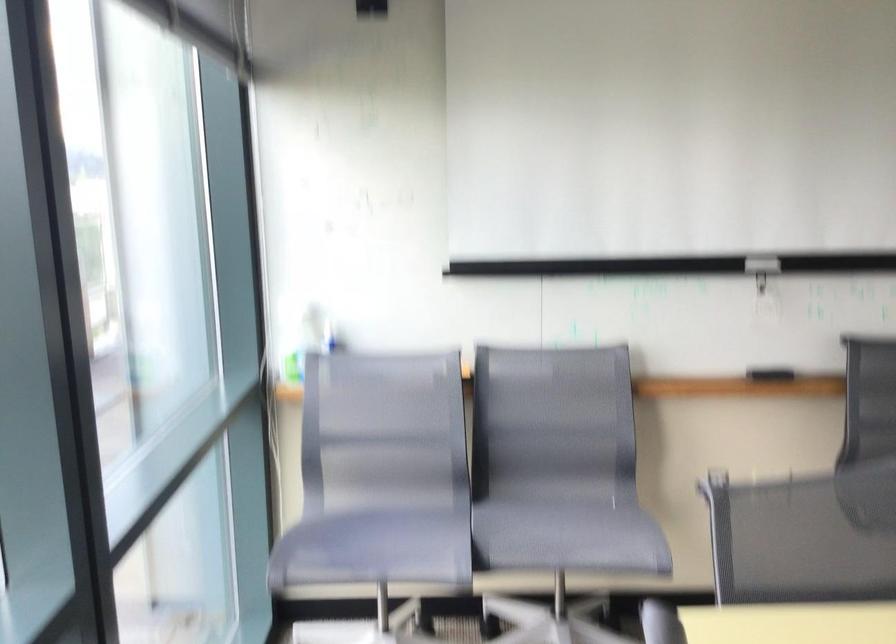
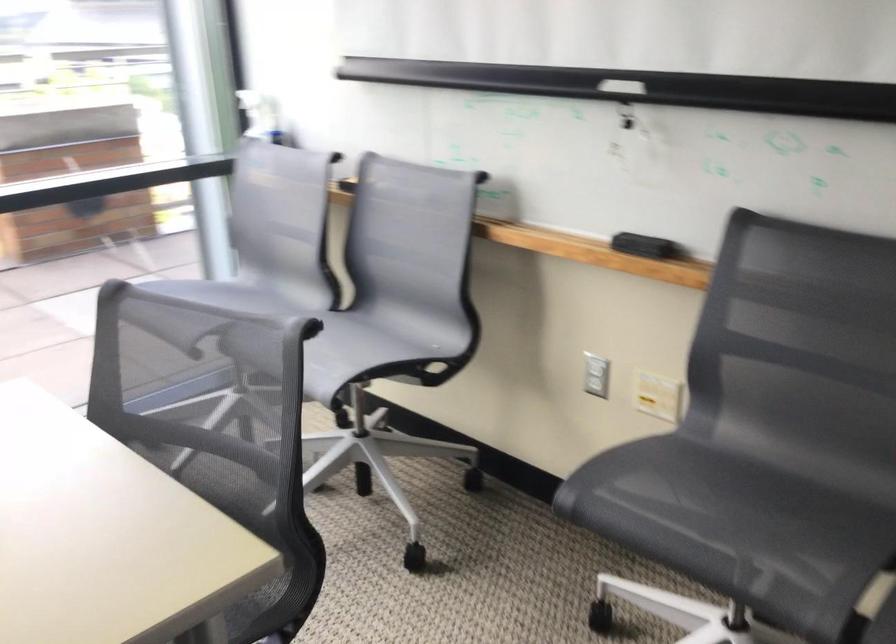
Locate, in the second image, the point that corresponds to point 346,516 in the first image.

(218, 290)